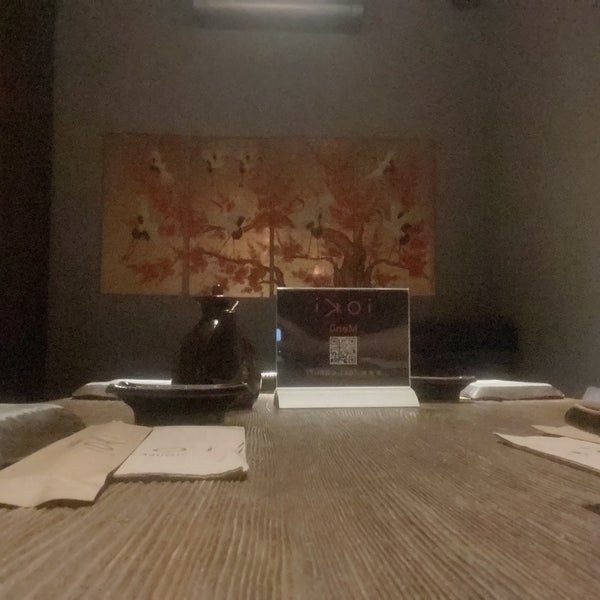
Where is `chopstick envelope`? The image size is (600, 600). chopstick envelope is located at coordinates (83, 455).